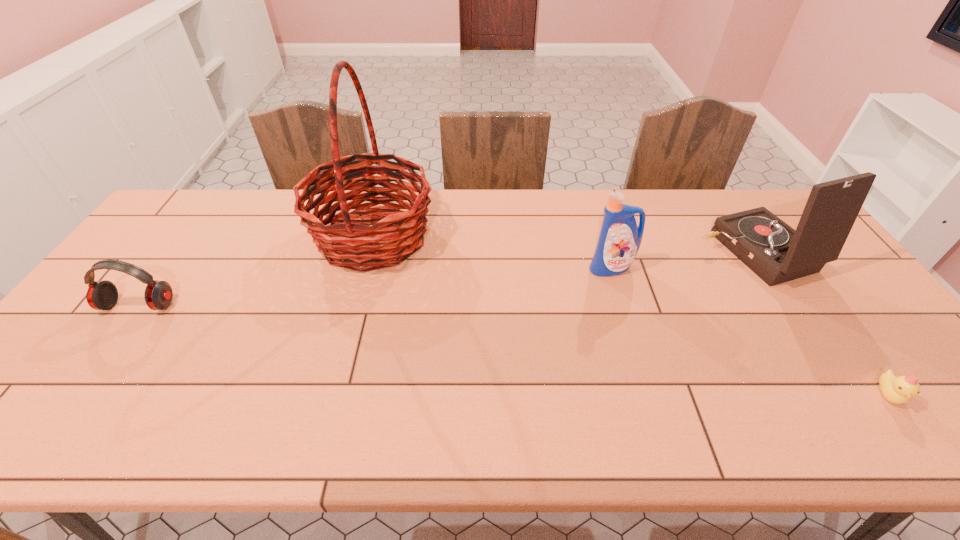
You are a GUI agent. You are given a task and a screenshot of the screen. Output one action in this format:
    pyautogui.click(x=<x>, y=<y>)
    Task: Click on the object that is at the far right corner
    The height and width of the screenshot is (540, 960).
    Given the screenshot: What is the action you would take?
    pyautogui.click(x=774, y=251)

At what (x,y) coordinates should I click in order to perform the action: click on object that is at the near right corner. Please return your answer as a coordinate pair (x, y). This screenshot has width=960, height=540. Looking at the image, I should click on (898, 390).

Find the location of a particular element. vacant region at the far edge of the desktop is located at coordinates (702, 211).

The image size is (960, 540). In the image, there is a desktop. Identify the location of vacant space at the near edge. (276, 426).

Find the location of a particular element. The width and height of the screenshot is (960, 540). vacant space at the far left corner is located at coordinates (196, 190).

Identify the location of blank region between the phonograph record and the nearest object. (821, 324).

Where is `vacant area between the third shortest object and the phonograph record`? Image resolution: width=960 pixels, height=540 pixels. vacant area between the third shortest object and the phonograph record is located at coordinates (683, 261).

You are a GUI agent. You are given a task and a screenshot of the screen. Output one action in this format:
    pyautogui.click(x=<x>, y=<y>)
    Task: Click on the unoccupied position between the third object from right to left and the second nearest object
    The height and width of the screenshot is (540, 960).
    Given the screenshot: What is the action you would take?
    pyautogui.click(x=375, y=287)

This screenshot has height=540, width=960. I want to click on free spot between the fourth shortest object and the shortest object, so click(821, 324).

I want to click on unoccupied area between the nearest object and the leftmost object, so click(513, 350).